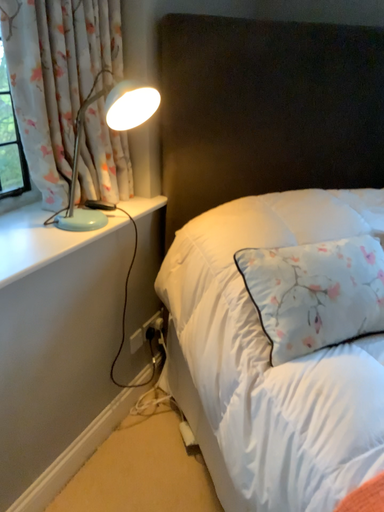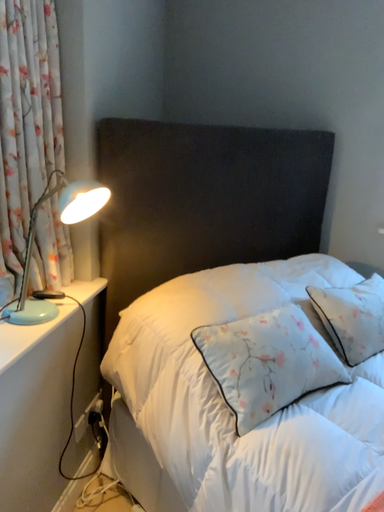
Question: Which way did the camera rotate in the video?

Choices:
 (A) rotated left
 (B) rotated right

Answer: (B)